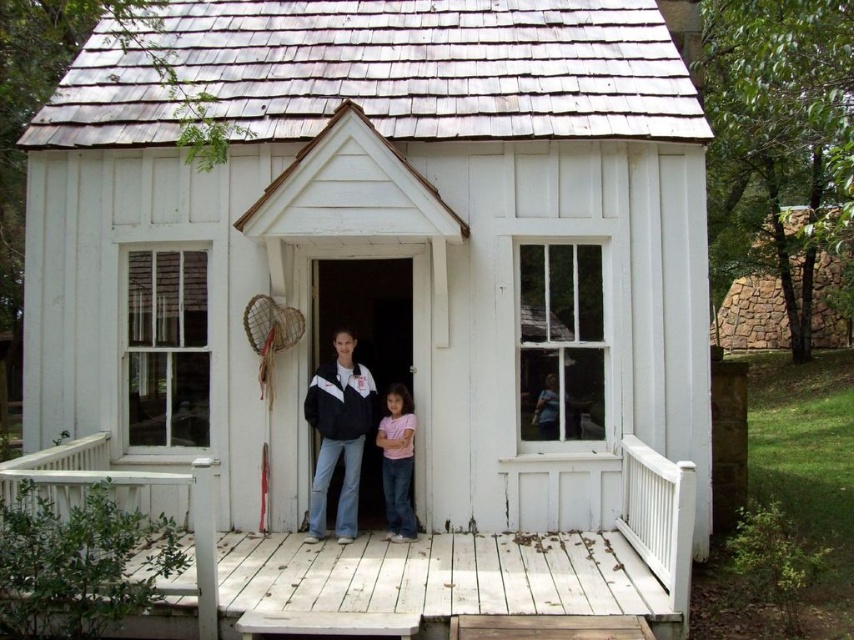
This screenshot has width=854, height=640. What do you see at coordinates (465, 570) in the screenshot?
I see `white wooden porch at center` at bounding box center [465, 570].

Who is higher up, white wooden porch at center or matte black jacket at center?

matte black jacket at center is higher up.

Is point (231, 600) closer to camera compared to point (342, 493)?

Yes, it is.

This screenshot has height=640, width=854. I want to click on white wooden porch at center, so pyautogui.click(x=465, y=570).

Can you confirm if matte black jacket at center is positioned to the left of pink cotton shirt at center?

Indeed, matte black jacket at center is positioned on the left side of pink cotton shirt at center.

Who is positioned more to the right, matte black jacket at center or pink cotton shirt at center?

Positioned to the right is pink cotton shirt at center.

Between point (338, 518) and point (407, 508), which one is positioned behind?

The point (407, 508) is more distant.

Locate an element on the screen. Image resolution: width=854 pixels, height=640 pixels. matte black jacket at center is located at coordinates (338, 433).

In the scene shown: Can you confirm if white wooden porch at center is positioned to the right of pink cotton shirt at center?

Yes, white wooden porch at center is to the right of pink cotton shirt at center.

Does point (639, 499) lie behind point (402, 486)?

No, it is not.

At what (x,y) coordinates should I click in order to perform the action: click on white wooden porch at center. Please return your answer as a coordinate pair (x, y). Looking at the image, I should click on (465, 570).